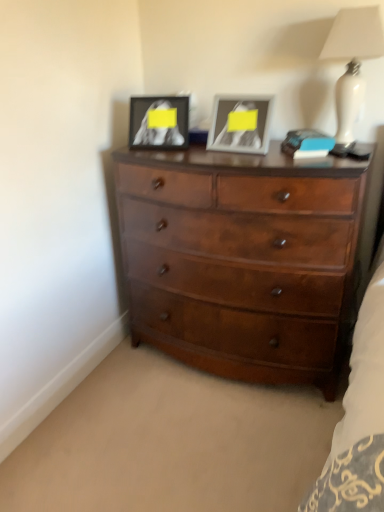
Question: In terms of width, does white glossy lamp at upper right look wider or thinner when compared to metallic silver picture frame at upper center, arranged as the first picture frame when viewed from the right?

Choices:
 (A) thin
 (B) wide

Answer: (B)

Question: Based on their sizes in the image, would you say white glossy lamp at upper right is bigger or smaller than metallic silver picture frame at upper center, the second picture frame viewed from the left?

Choices:
 (A) small
 (B) big

Answer: (B)

Question: Estimate the real-world distances between objects in this image. Which object is farther from the shiny brown wooden chest of drawers at center?

Choices:
 (A) matte black picture frame at upper center, the 1th picture frame viewed from the left
 (B) metallic silver picture frame at upper center, the second picture frame viewed from the left
 (C) white glossy lamp at upper right
 (D) blue matte book at upper right

Answer: (C)

Question: Which object is the closest to the metallic silver picture frame at upper center, the second picture frame viewed from the left?

Choices:
 (A) white glossy lamp at upper right
 (B) matte black picture frame at upper center, placed as the second picture frame when sorted from right to left
 (C) shiny brown wooden chest of drawers at center
 (D) blue matte book at upper right

Answer: (D)